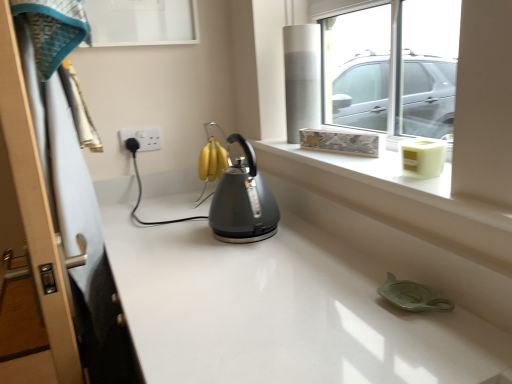
Question: Is satin grey kettle at center turned away from transparent glass window at upper center?

Choices:
 (A) no
 (B) yes

Answer: (B)

Question: Is satin grey kettle at center at the left side of transparent glass window at upper center?

Choices:
 (A) no
 (B) yes

Answer: (B)

Question: Is satin grey kettle at center bigger than transparent glass window at upper center?

Choices:
 (A) no
 (B) yes

Answer: (A)

Question: Is satin grey kettle at center to the right of transparent glass window at upper center from the viewer's perspective?

Choices:
 (A) yes
 (B) no

Answer: (B)

Question: Is satin grey kettle at center far away from transparent glass window at upper center?

Choices:
 (A) yes
 (B) no

Answer: (B)

Question: Does satin grey kettle at center lie in front of transparent glass window at upper center?

Choices:
 (A) yes
 (B) no

Answer: (B)

Question: Is transparent glass window at upper center not inside wooden screen door at left?

Choices:
 (A) no
 (B) yes

Answer: (B)

Question: From a real-world perspective, is transparent glass window at upper center located higher than wooden screen door at left?

Choices:
 (A) no
 (B) yes

Answer: (B)

Question: Is transparent glass window at upper center positioned before wooden screen door at left?

Choices:
 (A) yes
 (B) no

Answer: (B)

Question: Considering the relative sizes of transparent glass window at upper center and wooden screen door at left in the image provided, is transparent glass window at upper center thinner than wooden screen door at left?

Choices:
 (A) no
 (B) yes

Answer: (B)

Question: From a real-world perspective, is transparent glass window at upper center positioned under wooden screen door at left based on gravity?

Choices:
 (A) no
 (B) yes

Answer: (A)

Question: Considering the relative sizes of transparent glass window at upper center and wooden screen door at left in the image provided, is transparent glass window at upper center wider than wooden screen door at left?

Choices:
 (A) yes
 (B) no

Answer: (B)

Question: Considering the relative sizes of transparent glass window at upper center and satin grey kettle at center in the image provided, is transparent glass window at upper center smaller than satin grey kettle at center?

Choices:
 (A) no
 (B) yes

Answer: (A)